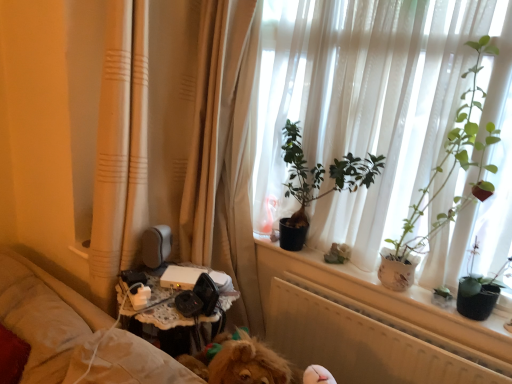
Question: Does green matte plant at upper right, which is counted as the 1th houseplant, starting from the right, have a lesser width compared to beige fabric curtain at left?

Choices:
 (A) yes
 (B) no

Answer: (A)

Question: Does green matte plant at upper right, placed as the 2th houseplant when sorted from left to right, have a greater width compared to beige fabric curtain at left?

Choices:
 (A) no
 (B) yes

Answer: (A)

Question: Would you say green matte plant at upper right, placed as the 2th houseplant when sorted from left to right, contains beige fabric curtain at left?

Choices:
 (A) no
 (B) yes

Answer: (A)

Question: Is green matte plant at upper right, placed as the 2th houseplant when sorted from left to right, shorter than beige fabric curtain at left?

Choices:
 (A) no
 (B) yes

Answer: (B)

Question: Are green matte plant at upper right, placed as the 2th houseplant when sorted from left to right, and beige fabric curtain at left making contact?

Choices:
 (A) yes
 (B) no

Answer: (B)

Question: Relative to green matte plant at center, the 2th houseplant positioned from the right, is beige fabric curtain at left in front or behind?

Choices:
 (A) front
 (B) behind

Answer: (A)

Question: In terms of height, does beige fabric curtain at left look taller or shorter compared to green matte plant at center, the 2th houseplant positioned from the right?

Choices:
 (A) short
 (B) tall

Answer: (B)

Question: Considering the relative positions of beige fabric curtain at left and green matte plant at center, acting as the first houseplant starting from the left, in the image provided, is beige fabric curtain at left to the left or to the right of green matte plant at center, acting as the first houseplant starting from the left,?

Choices:
 (A) left
 (B) right

Answer: (A)

Question: Looking at their shapes, would you say beige fabric curtain at left is wider or thinner than green matte plant at center, the 2th houseplant positioned from the right?

Choices:
 (A) thin
 (B) wide

Answer: (B)

Question: From a real-world perspective, relative to green matte plant at upper right, which is counted as the 1th houseplant, starting from the right, is beige fabric curtain at left vertically above or below?

Choices:
 (A) above
 (B) below

Answer: (B)

Question: Relative to green matte plant at upper right, which is counted as the 1th houseplant, starting from the right, is beige fabric curtain at left in front or behind?

Choices:
 (A) front
 (B) behind

Answer: (A)

Question: From the image's perspective, is beige fabric curtain at left positioned above or below green matte plant at upper right, which is counted as the 1th houseplant, starting from the right?

Choices:
 (A) below
 (B) above

Answer: (B)

Question: In the image, is beige fabric curtain at left on the left side or the right side of green matte plant at upper right, which is counted as the 1th houseplant, starting from the right?

Choices:
 (A) right
 (B) left

Answer: (B)

Question: Considering the positions of green matte plant at center, the 2th houseplant positioned from the right, and beige fabric curtain at left in the image, is green matte plant at center, the 2th houseplant positioned from the right, wider or thinner than beige fabric curtain at left?

Choices:
 (A) thin
 (B) wide

Answer: (A)

Question: Considering the positions of green matte plant at center, acting as the first houseplant starting from the left, and beige fabric curtain at left in the image, is green matte plant at center, acting as the first houseplant starting from the left, taller or shorter than beige fabric curtain at left?

Choices:
 (A) short
 (B) tall

Answer: (A)